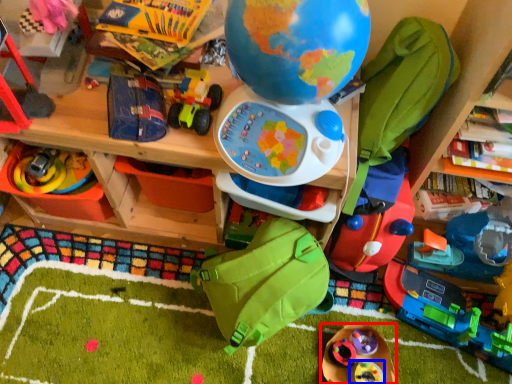
Question: Which of the following is the closest to the observer, toy (highlighted by a red box) or toy (highlighted by a blue box)?

Choices:
 (A) toy
 (B) toy

Answer: (A)